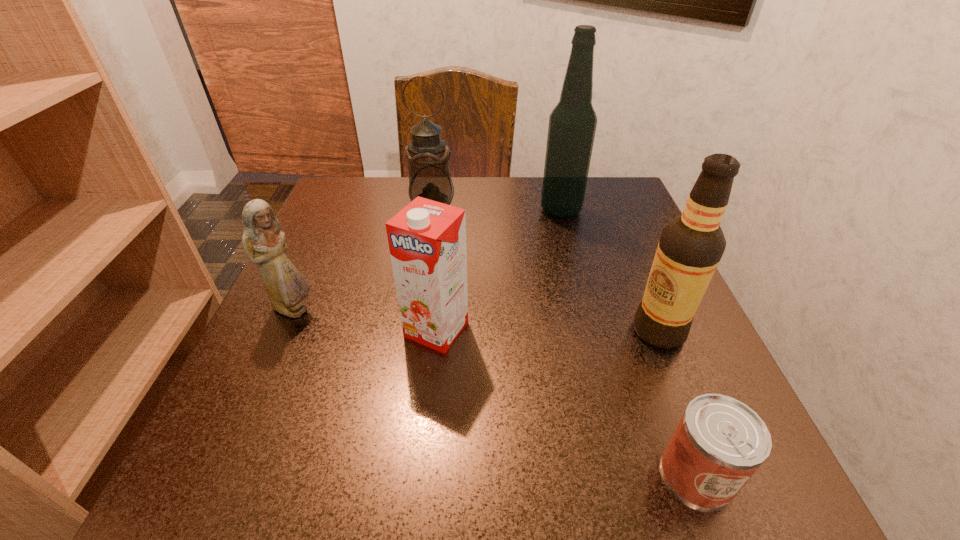
Identify the location of object that is positioned at the left edge. (263, 240).

Where is `can that is at the right edge`? This screenshot has height=540, width=960. can that is at the right edge is located at coordinates (719, 443).

At what (x,y) coordinates should I click in order to perform the action: click on object that is at the far right corner. Please return your answer as a coordinate pair (x, y). Looking at the image, I should click on (572, 124).

The width and height of the screenshot is (960, 540). Identify the location of object positioned at the near right corner. (719, 443).

In the image, there is a desktop. Where is `vacant space at the far edge`? The image size is (960, 540). vacant space at the far edge is located at coordinates (496, 188).

Locate an element on the screen. Image resolution: width=960 pixels, height=540 pixels. vacant space at the near edge of the desktop is located at coordinates (550, 502).

Where is `vacant area at the left edge`? vacant area at the left edge is located at coordinates (350, 239).

Locate an element on the screen. This screenshot has width=960, height=540. blank space at the right edge of the desktop is located at coordinates (640, 272).

Where is `vacant area at the far left corner of the desktop`? The width and height of the screenshot is (960, 540). vacant area at the far left corner of the desktop is located at coordinates point(325,199).

Where is `free region at the far right corner`? free region at the far right corner is located at coordinates (589, 184).